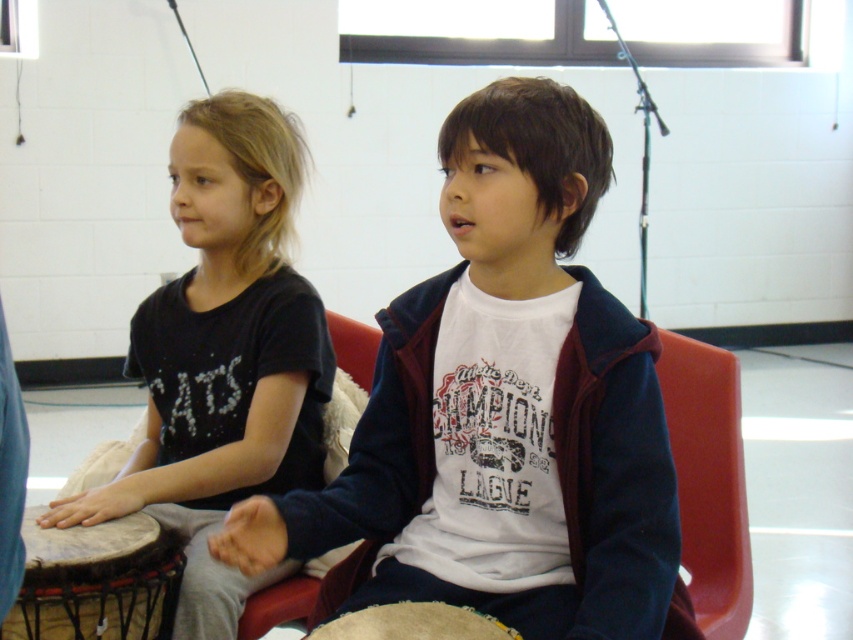
Question: Estimate the real-world distances between objects in this image. Which object is farther from the beige textured drum at center?

Choices:
 (A) natural wood drum at lower left
 (B) white cotton shirt at center

Answer: (A)

Question: Can you confirm if white cotton shirt at center is positioned below beige textured drum at center?

Choices:
 (A) no
 (B) yes

Answer: (A)

Question: Is natural wood drum at lower left wider than beige textured drum at center?

Choices:
 (A) no
 (B) yes

Answer: (B)

Question: Is white cotton shirt at center further to the viewer compared to natural wood drum at lower left?

Choices:
 (A) yes
 (B) no

Answer: (B)

Question: Estimate the real-world distances between objects in this image. Which object is closer to the beige textured drum at center?

Choices:
 (A) white cotton shirt at center
 (B) natural wood drum at lower left
 (C) black matte shirt at left

Answer: (A)

Question: Which point is farther to the camera?

Choices:
 (A) white cotton shirt at center
 (B) natural wood drum at lower left
 (C) beige textured drum at center
 (D) black matte shirt at left

Answer: (D)